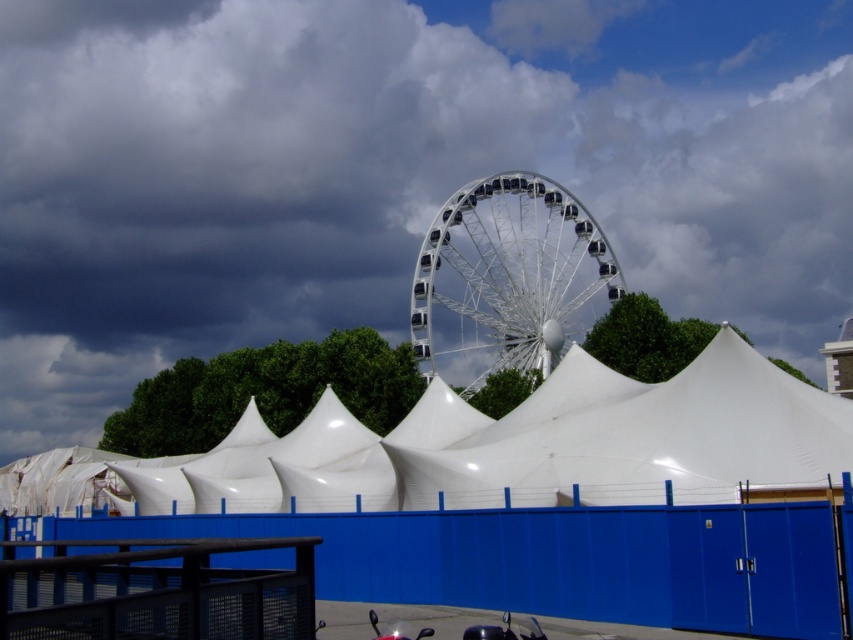
You are standing at the entrance of the blue temporary fence and want to find the white matte tent at center. According to the coordinates provided, in which direction should you walk to reach it?

The white matte tent at center is located at point coordinates, so you should walk towards the center area to reach it.

You are standing in front of the Ferris wheel and want to take a photo that includes both point (825, 60) and point (578, 340). Which point will appear closer to the front of the photo?

Point (825, 60) is further to the camera than point (578, 340), so it will appear closer to the front of the photo.

You are at a fairground and want to take a photo of both the white fluffy cloud at upper center and the white matte tent at center. Which object should you position closer to the right side of your camera frame?

You should position the white fluffy cloud at upper center closer to the right side of your camera frame since it is located to the right of the white matte tent at center.